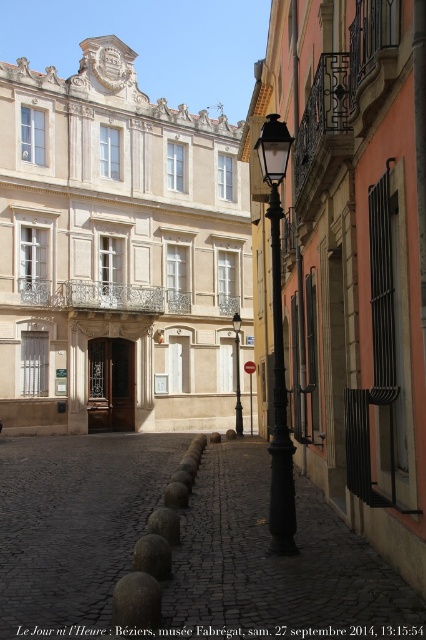
Which is below, polished metal streetlamp at center or black metal lamp post at center?

black metal lamp post at center is lower down.

Can you confirm if polished metal streetlamp at center is bigger than black metal lamp post at center?

Indeed, polished metal streetlamp at center has a larger size compared to black metal lamp post at center.

Is point (279, 124) in front of point (236, 337)?

Yes, point (279, 124) is in front of point (236, 337).

Identify the location of polished metal streetlamp at center. The width and height of the screenshot is (426, 640). (278, 344).